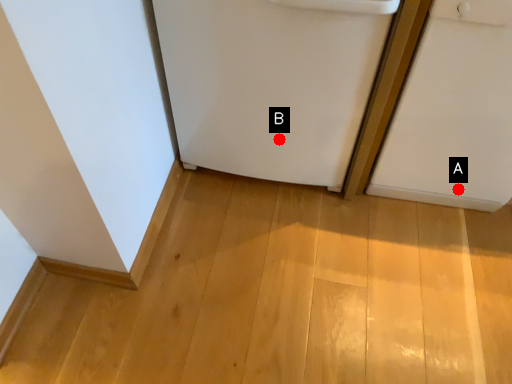
Question: Two points are circled on the image, labeled by A and B beside each circle. Which point appears farthest from the camera in this image?

Choices:
 (A) A is further
 (B) B is further

Answer: (A)